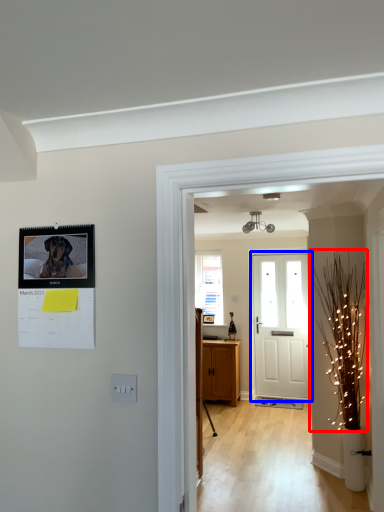
Question: Which object is further to the camera taking this photo, christmas light (highlighted by a red box) or door (highlighted by a blue box)?

Choices:
 (A) christmas light
 (B) door

Answer: (B)